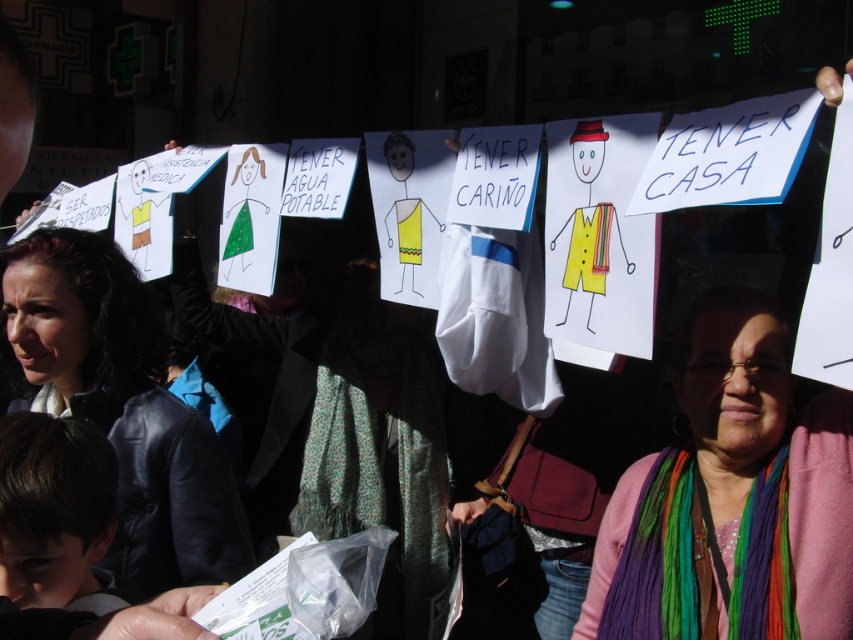
Looking at this image, does multicolored scarf at center appear on the right side of matte black jacket at left?

Correct, you'll find multicolored scarf at center to the right of matte black jacket at left.

What do you see at coordinates (734, 493) in the screenshot? I see `multicolored scarf at center` at bounding box center [734, 493].

Find the location of a particular element. multicolored scarf at center is located at coordinates (734, 493).